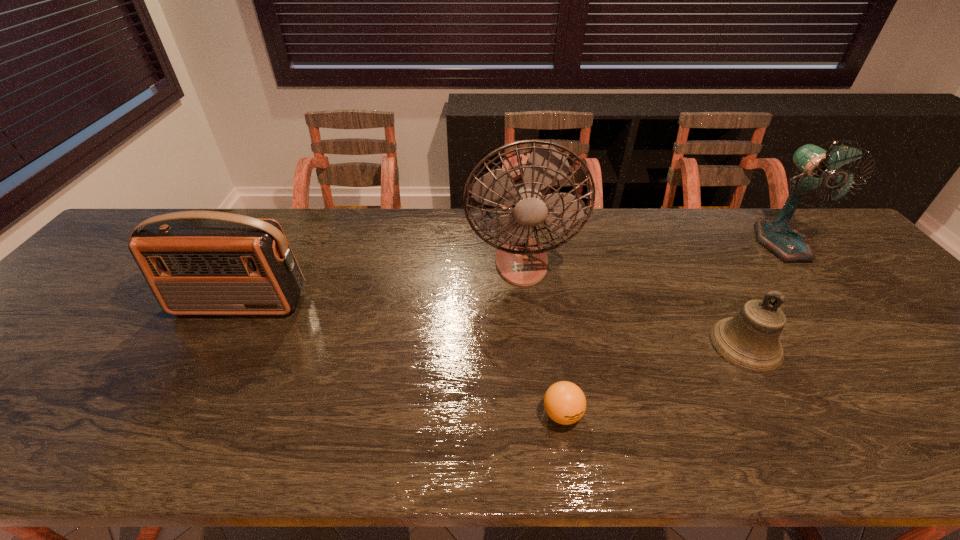
Locate an element on the screen. This screenshot has width=960, height=540. the left fan is located at coordinates (525, 186).

Where is `the second tallest object`? the second tallest object is located at coordinates (818, 167).

Where is `the rightmost object`? The image size is (960, 540). the rightmost object is located at coordinates (818, 167).

The height and width of the screenshot is (540, 960). Find the location of `the third tallest object`. the third tallest object is located at coordinates (195, 262).

The width and height of the screenshot is (960, 540). Identify the location of the leftmost object. (195, 262).

Where is `the second shortest object`? The image size is (960, 540). the second shortest object is located at coordinates (750, 340).

Locate an element on the screen. Image resolution: width=960 pixels, height=540 pixels. the fourth object from left to right is located at coordinates (750, 340).

Locate an element on the screen. The width and height of the screenshot is (960, 540). the shortest object is located at coordinates (565, 403).

You are a GUI agent. You are given a task and a screenshot of the screen. Output one action in this format:
    pyautogui.click(x=<x>, y=<y>)
    Task: Click on the nearest object
    The image size is (960, 540).
    Given the screenshot: What is the action you would take?
    pyautogui.click(x=565, y=403)

Where is `vacant space situated 0.090m in front of the left fan to direct airflow`? The image size is (960, 540). vacant space situated 0.090m in front of the left fan to direct airflow is located at coordinates (527, 314).